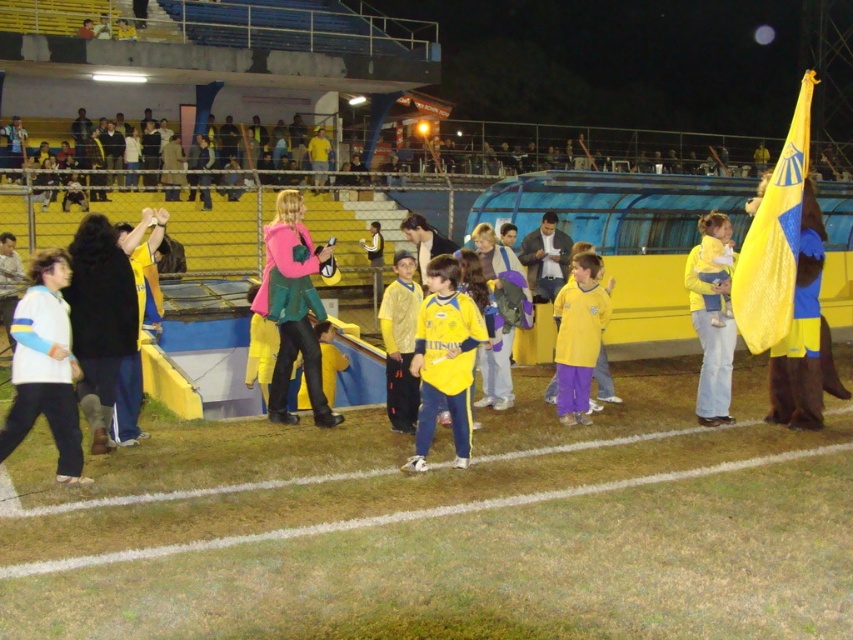
You are a photographer standing at the edge of the soccer field. You want to take a photo that includes both the white fleece jacket at lower left and the pink fabric jacket at center. Given that your camera has a maximum focus range of 8 feet, will you be able to capture both subjects in focus?

The white fleece jacket at lower left is 7.78 feet away from the pink fabric jacket at center. Since the distance between them is within the camera maximum focus range of 8 feet, you can capture both subjects in focus.

You are standing at the point with coordinates point (45, 365) in the image. What object is located at that point?

The point (45, 365) corresponds to the white fleece jacket at lower left.